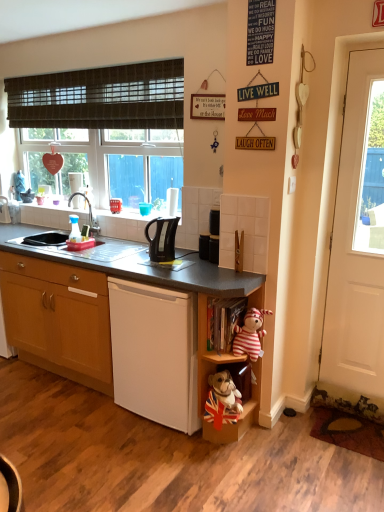
Question: Is brushed metal faucet at upper left oriented away from wooden cabinet at lower left?

Choices:
 (A) yes
 (B) no

Answer: (B)

Question: From a real-world perspective, is brushed metal faucet at upper left located beneath wooden cabinet at lower left?

Choices:
 (A) no
 (B) yes

Answer: (A)

Question: Is brushed metal faucet at upper left positioned behind wooden cabinet at lower left?

Choices:
 (A) yes
 (B) no

Answer: (A)

Question: Considering the relative sizes of brushed metal faucet at upper left and wooden cabinet at lower left in the image provided, is brushed metal faucet at upper left taller than wooden cabinet at lower left?

Choices:
 (A) no
 (B) yes

Answer: (A)

Question: From the image's perspective, is brushed metal faucet at upper left below wooden cabinet at lower left?

Choices:
 (A) yes
 (B) no

Answer: (B)

Question: In terms of height, does brushed metal faucet at upper left look taller or shorter compared to wooden bookshelf at lower center, acting as the 1th shelf starting from the bottom?

Choices:
 (A) tall
 (B) short

Answer: (B)

Question: From a real-world perspective, is brushed metal faucet at upper left positioned above or below wooden bookshelf at lower center, acting as the second shelf starting from the top?

Choices:
 (A) below
 (B) above

Answer: (B)

Question: Is brushed metal faucet at upper left in front of or behind wooden bookshelf at lower center, acting as the second shelf starting from the top, in the image?

Choices:
 (A) front
 (B) behind

Answer: (B)

Question: Based on their sizes in the image, would you say brushed metal faucet at upper left is bigger or smaller than wooden bookshelf at lower center, acting as the 1th shelf starting from the bottom?

Choices:
 (A) small
 (B) big

Answer: (A)

Question: From the image's perspective, is black plastic kettle at center positioned above or below white wooden door at right?

Choices:
 (A) above
 (B) below

Answer: (B)

Question: Considering the positions of black plastic kettle at center and white wooden door at right in the image, is black plastic kettle at center taller or shorter than white wooden door at right?

Choices:
 (A) tall
 (B) short

Answer: (B)

Question: Do you think black plastic kettle at center is within white wooden door at right, or outside of it?

Choices:
 (A) outside
 (B) inside

Answer: (A)

Question: From a real-world perspective, is black plastic kettle at center physically located above or below white wooden door at right?

Choices:
 (A) below
 (B) above

Answer: (A)

Question: From a real-world perspective, is striped fabric stuffed animal at lower right above or below black plastic kettle at center?

Choices:
 (A) above
 (B) below

Answer: (B)

Question: Based on their sizes in the image, would you say striped fabric stuffed animal at lower right is bigger or smaller than black plastic kettle at center?

Choices:
 (A) big
 (B) small

Answer: (A)